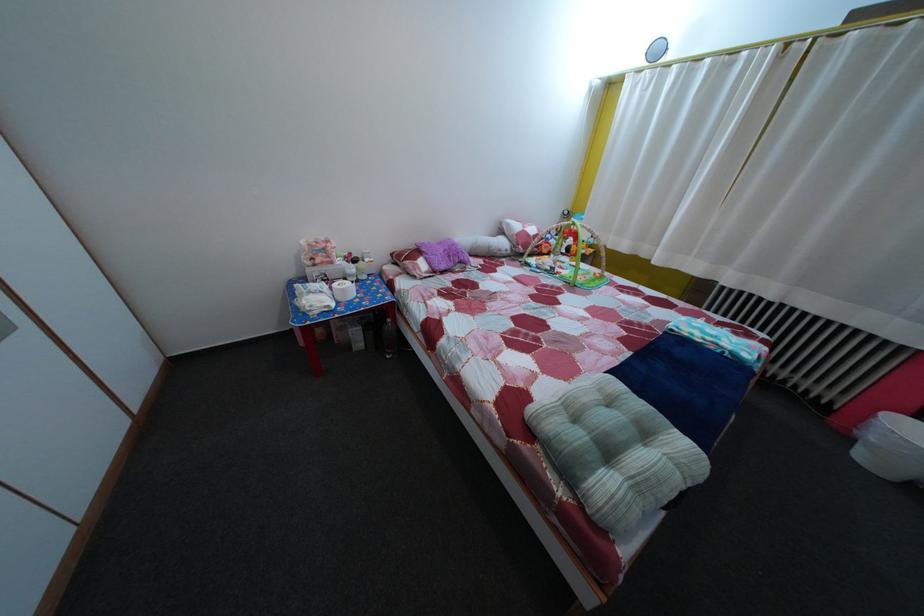
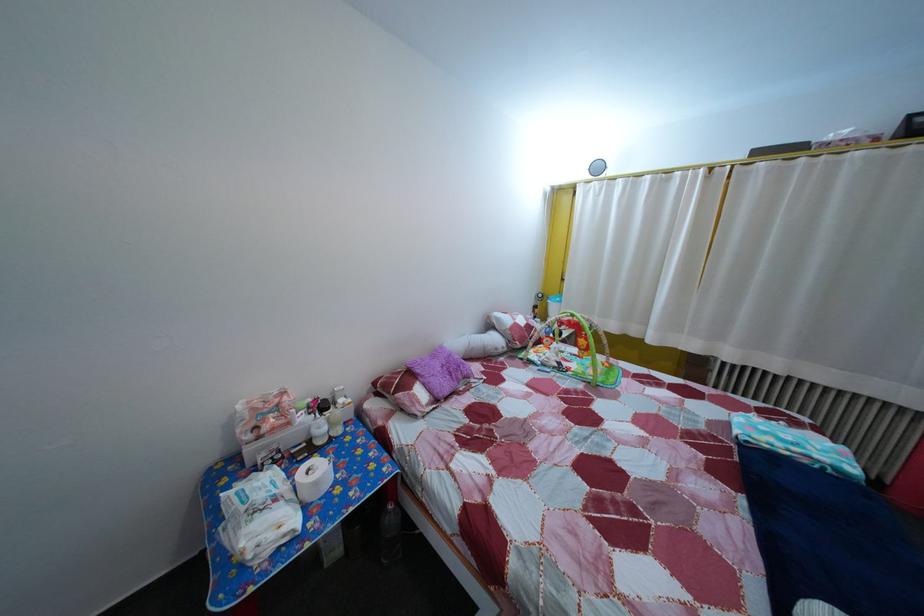
Locate, in the second image, the point that corresponds to (x=349, y=270) in the first image.

(311, 427)